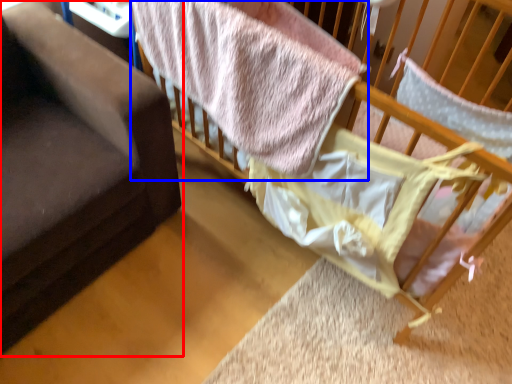
Question: Among these objects, which one is nearest to the camera, furniture (highlighted by a red box) or bed (highlighted by a blue box)?

Choices:
 (A) furniture
 (B) bed

Answer: (A)